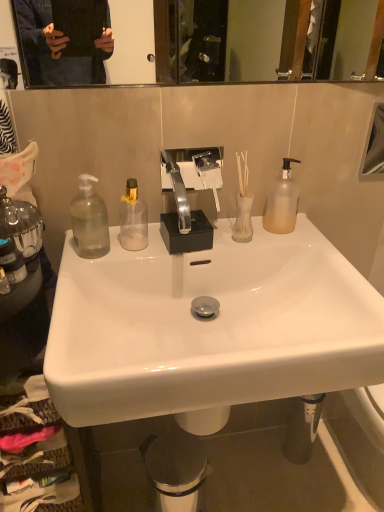
Question: In terms of size, does white glossy sink at center appear bigger or smaller than clear glass soap dispenser at left, acting as the 5th bottle starting from the right?

Choices:
 (A) big
 (B) small

Answer: (A)

Question: From a real-world perspective, is white glossy sink at center positioned above or below clear glass soap dispenser at left, acting as the 5th bottle starting from the right?

Choices:
 (A) above
 (B) below

Answer: (B)

Question: Which object is positioned farthest from the metallic trash can at lower center?

Choices:
 (A) clear glass soap dispenser at left, the 2th bottle in the left-to-right sequence
 (B) clear glass soap dispenser at left, acting as the 5th bottle starting from the right
 (C) frosted glass pump bottle at right, the fifth bottle from the left
 (D) transparent plastic bottle at left, the 3th bottle when ordered from right to left
 (E) transparent plastic bottle at center, acting as the 2th bottle starting from the right

Answer: (A)

Question: Considering the real-world distances, which object is closest to the transparent plastic bottle at center, which is the fourth bottle from left to right?

Choices:
 (A) clear glass soap dispenser at left, acting as the 5th bottle starting from the right
 (B) clear glass soap dispenser at left, positioned as the 4th bottle in right-to-left order
 (C) glossy glass mirror at upper right
 (D) white glossy sink at center
 (E) transparent plastic bottle at left, the 3th bottle when ordered from right to left

Answer: (E)